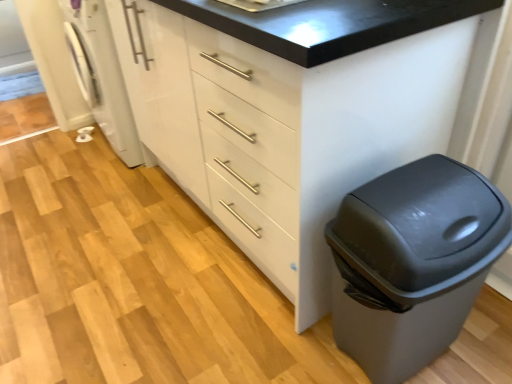
I want to click on free space in front of white glossy washing machine at left, so click(90, 196).